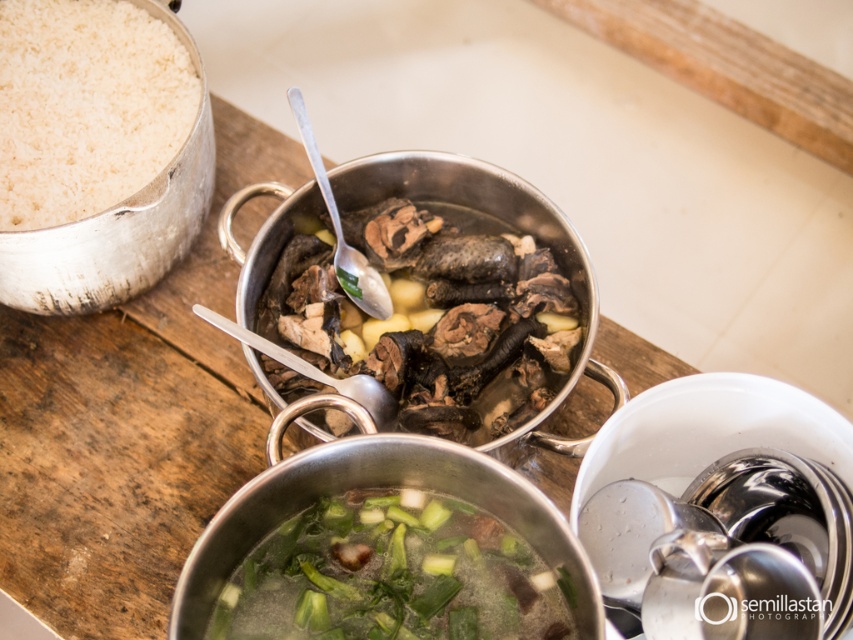
In the rustic kitchen scene, you see a brown matte meat at center and green leafy vegetables at center. Which item is positioned to the right of the other?

The brown matte meat at center is to the right of green leafy vegetables at center.